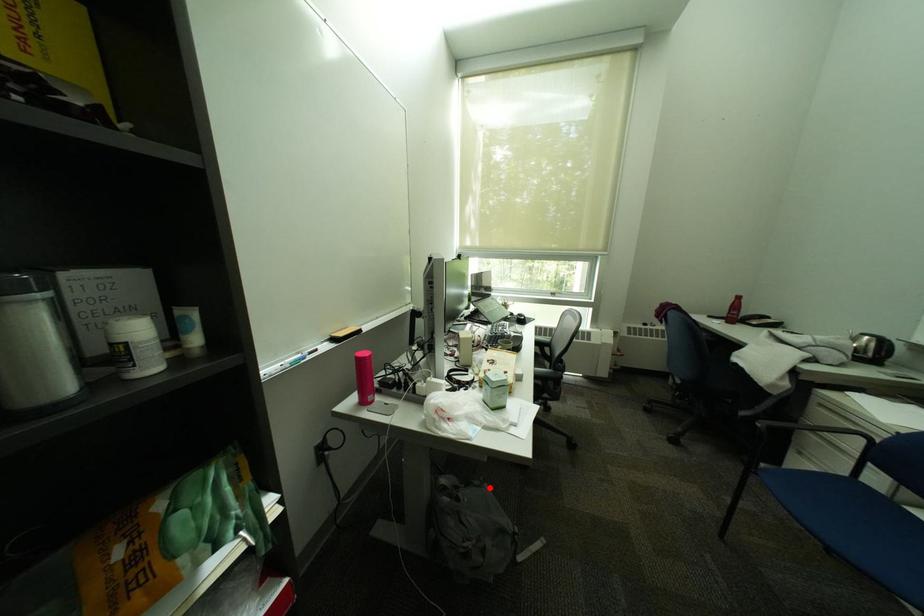
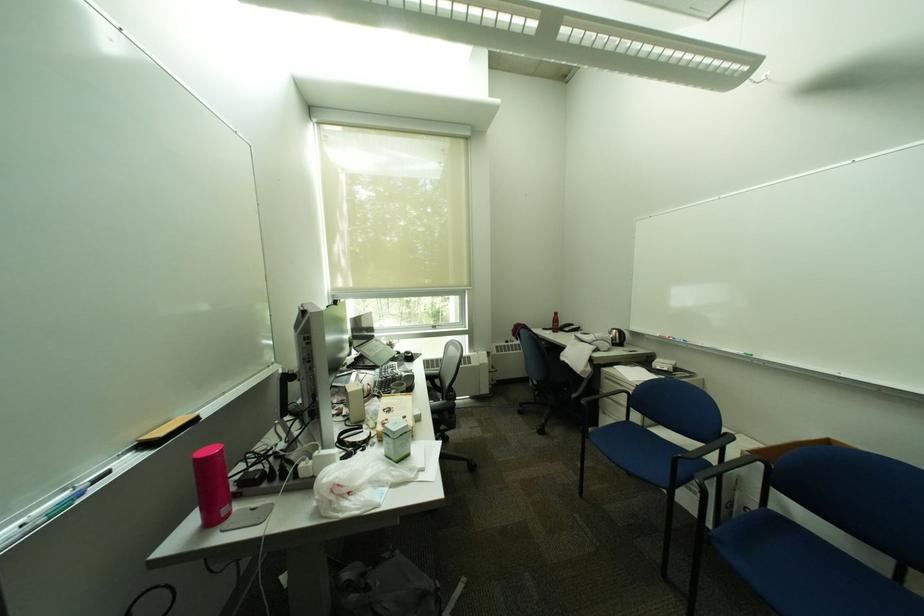
Locate, in the second image, the point that corresponds to the highlighted location in the first image.

(400, 560)